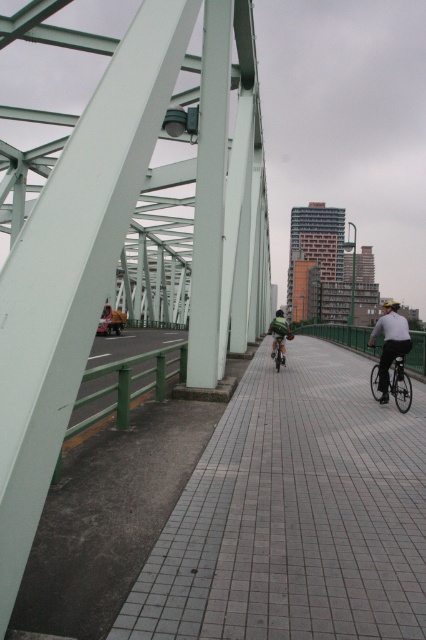
Question: Can you confirm if metallic gray bridge at center is positioned to the right of green matte bicycle at center?

Choices:
 (A) no
 (B) yes

Answer: (A)

Question: Which is nearer to the smooth concrete sidewalk at center?

Choices:
 (A) shiny silver bicycle at center-right
 (B) green matte jacket at center

Answer: (A)

Question: Can you confirm if metallic gray bridge at center is wider than shiny silver bicycle at center-right?

Choices:
 (A) yes
 (B) no

Answer: (A)

Question: Observing the image, what is the correct spatial positioning of metallic gray bridge at center in reference to green matte jacket at center?

Choices:
 (A) above
 (B) below

Answer: (A)

Question: Based on their relative distances, which object is farther from the shiny silver bicycle at center-right?

Choices:
 (A) green matte bicycle at center
 (B) metallic gray bridge at center
 (C) green matte jacket at center
 (D) smooth concrete sidewalk at center

Answer: (B)

Question: Among these points, which one is nearest to the camera?

Choices:
 (A) (170, 524)
 (B) (268, 324)
 (C) (222, 218)
 (D) (402, 376)

Answer: (A)